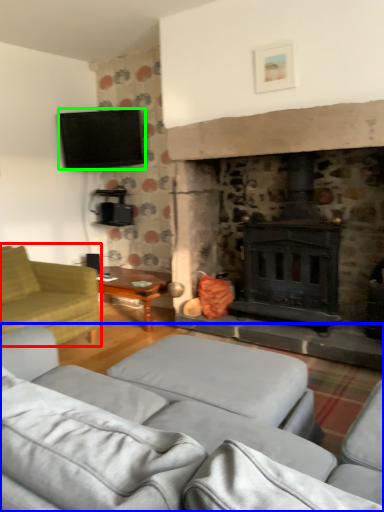
Question: Based on their relative distances, which object is nearer to studio couch (highlighted by a red box)? Choose from studio couch (highlighted by a blue box) and television (highlighted by a green box).

Choices:
 (A) studio couch
 (B) television

Answer: (A)